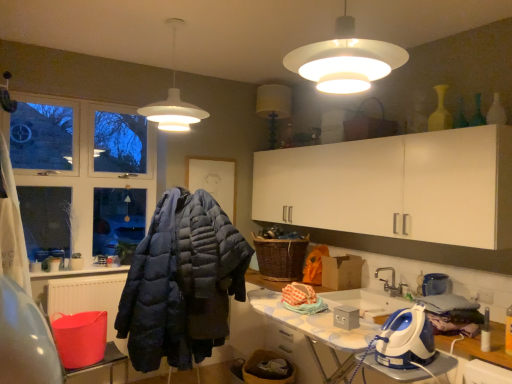
Question: Does white glossy ironing board at lower right have a smaller size compared to white matte pendant light at upper center, which is counted as the 1th lamp, starting from the left?

Choices:
 (A) no
 (B) yes

Answer: (A)

Question: Can you confirm if white glossy ironing board at lower right is bigger than white matte pendant light at upper center, which appears as the second lamp when viewed from the front?

Choices:
 (A) yes
 (B) no

Answer: (A)

Question: Is white glossy ironing board at lower right wider than white matte pendant light at upper center, which appears as the second lamp when viewed from the front?

Choices:
 (A) yes
 (B) no

Answer: (A)

Question: Can you confirm if white glossy ironing board at lower right is taller than white matte pendant light at upper center, the first lamp when ordered from back to front?

Choices:
 (A) no
 (B) yes

Answer: (B)

Question: From the image's perspective, is white glossy ironing board at lower right over white matte pendant light at upper center, the 2th lamp from the right?

Choices:
 (A) no
 (B) yes

Answer: (A)

Question: From the image's perspective, is white glossy ironing board at lower right beneath white matte pendant light at upper center, which appears as the second lamp when viewed from the front?

Choices:
 (A) no
 (B) yes

Answer: (B)

Question: Is white matte pendant light at upper center, which is counted as the 1th lamp, starting from the left, next to white matte lampshade at upper center, the second lamp from the back, and touching it?

Choices:
 (A) no
 (B) yes

Answer: (A)

Question: Can you confirm if white matte pendant light at upper center, the first lamp when ordered from back to front, is smaller than white matte lampshade at upper center, which is the 2th lamp from left to right?

Choices:
 (A) no
 (B) yes

Answer: (A)

Question: From the image's perspective, is white matte pendant light at upper center, the first lamp when ordered from back to front, located above white matte lampshade at upper center, the second lamp from the back?

Choices:
 (A) no
 (B) yes

Answer: (B)

Question: From a real-world perspective, is white matte pendant light at upper center, the 2th lamp from the right, positioned under white matte lampshade at upper center, arranged as the first lamp when viewed from the front, based on gravity?

Choices:
 (A) no
 (B) yes

Answer: (A)

Question: Is white matte pendant light at upper center, which appears as the second lamp when viewed from the front, to the left of white matte lampshade at upper center, arranged as the first lamp when viewed from the front, from the viewer's perspective?

Choices:
 (A) yes
 (B) no

Answer: (A)

Question: Is white matte pendant light at upper center, the first lamp when ordered from back to front, turned away from white matte lampshade at upper center, arranged as the first lamp when viewed from the front?

Choices:
 (A) no
 (B) yes

Answer: (A)

Question: Would you consider woven brown laundry basket at center to be distant from white matte lampshade at upper center, which is the 2th lamp from left to right?

Choices:
 (A) yes
 (B) no

Answer: (A)